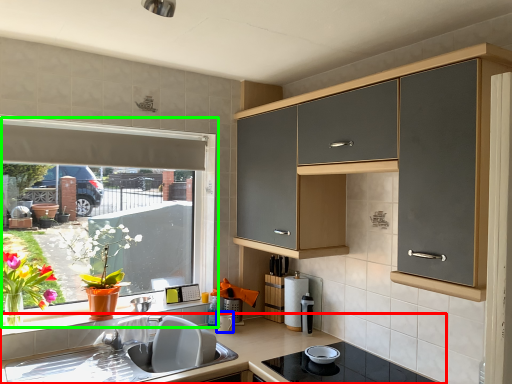
Question: Based on their relative distances, which object is nearer to countertop (highlighted by a red box)? Choose from appliance (highlighted by a blue box) and window (highlighted by a green box).

Choices:
 (A) appliance
 (B) window

Answer: (A)